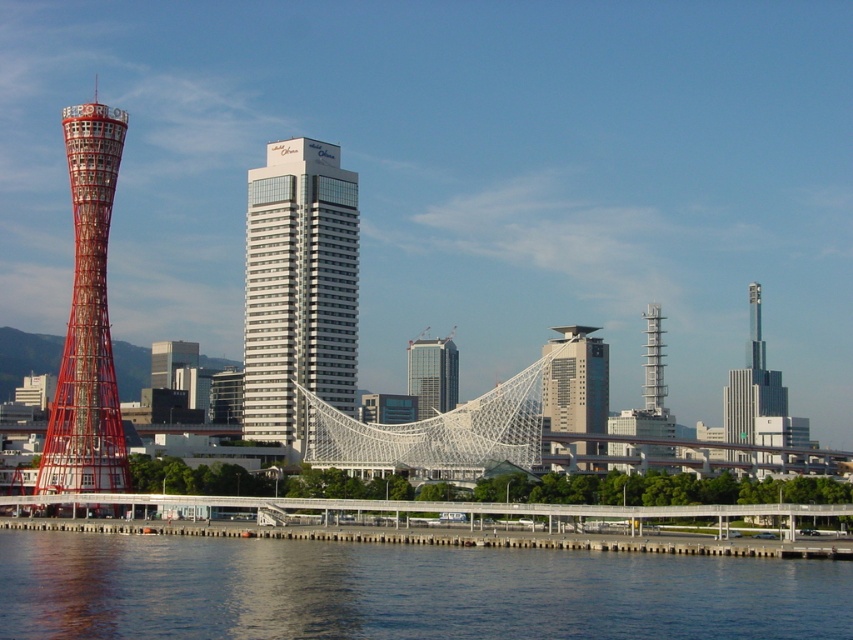
You are a photographer planning to capture a wide shot of the Kobe Port area. You notice the blue water at lower left and the matte glass skyscraper at center. Based on their positions, which object would likely occupy more horizontal space in your photograph?

The blue water at lower left might be wider than the matte glass skyscraper at center, so it would likely occupy more horizontal space in the photograph.

You are standing at the camera position observing the Kobe Port red tower and the point at coordinates (764, 516). Which object is closer to you?

The point at coordinates (764, 516) is closer to you than the Kobe Port red tower because its distance from the camera is 132.17 meters, which is shorter than the distance to the Kobe Port red tower.